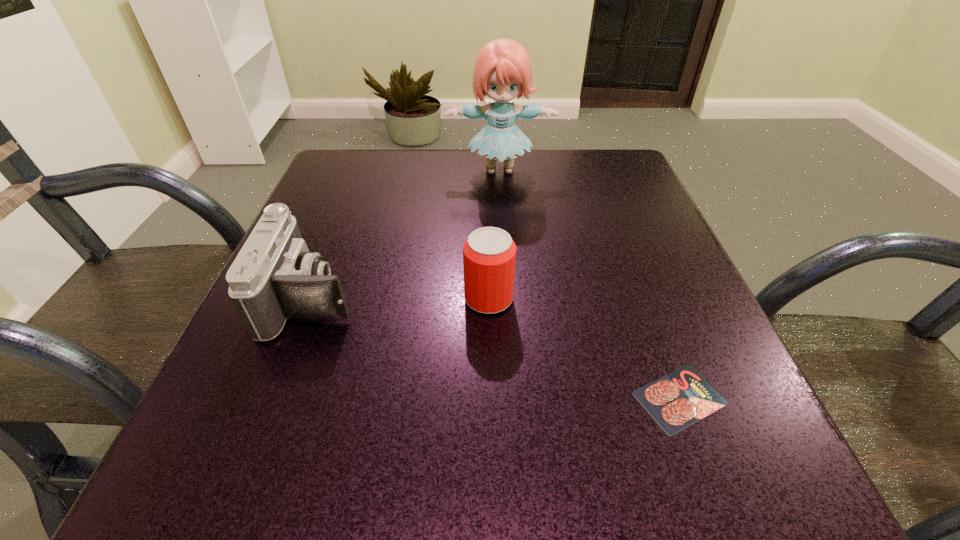
What are the coordinates of `free spot that satisfies the following two spatial constraints: 1. at the front of the camera with an open lens cover; 2. on the back side of the beer can` in the screenshot? It's located at (313, 299).